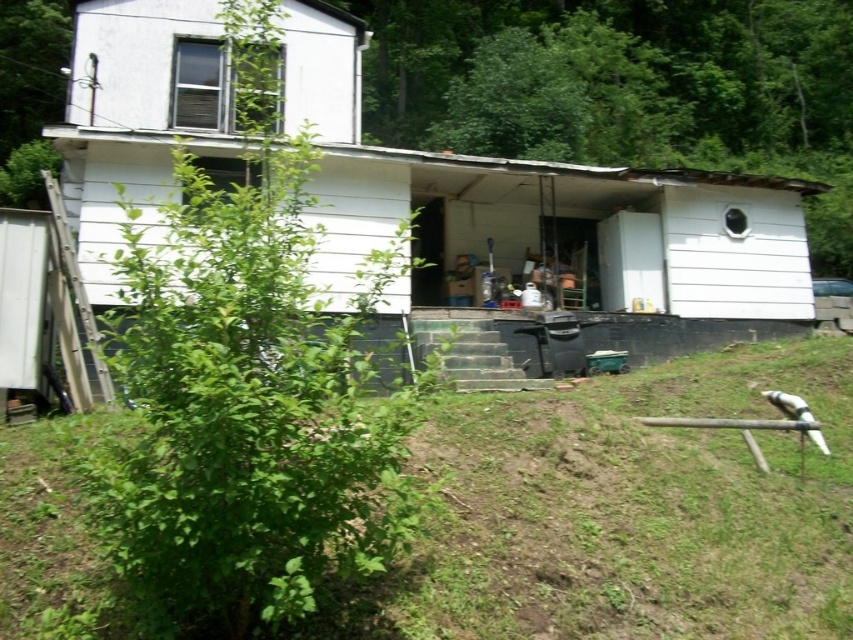
Locate an element on the screen. The image size is (853, 640). green grass at lower left is located at coordinates (628, 509).

Looking at this image, which is above, green grass at lower left or white matte shed at center?

white matte shed at center is above.

Which is behind, point (511, 428) or point (720, 186)?

Positioned behind is point (720, 186).

You are a GUI agent. You are given a task and a screenshot of the screen. Output one action in this format:
    pyautogui.click(x=<x>, y=<y>)
    Task: Click on the green grass at lower left
    
    Given the screenshot: What is the action you would take?
    pyautogui.click(x=628, y=509)

Can you confirm if green leafy bush at center is taller than white matte shed at center?

Yes.

From the picture: Is green leafy bush at center positioned behind white matte shed at center?

No, green leafy bush at center is in front of white matte shed at center.

Which is behind, point (200, 525) or point (76, 128)?

Positioned behind is point (76, 128).

This screenshot has height=640, width=853. I want to click on green leafy bush at center, so click(x=248, y=381).

Is green grass at lower left positioned before green leafy bush at center?

No, it is not.

Measure the distance from green grass at lower left to green leafy bush at center.

green grass at lower left is 3.98 feet away from green leafy bush at center.

Is point (605, 396) in front of point (253, 209)?

No, it is not.

Find the location of a particular element. green grass at lower left is located at coordinates (628, 509).